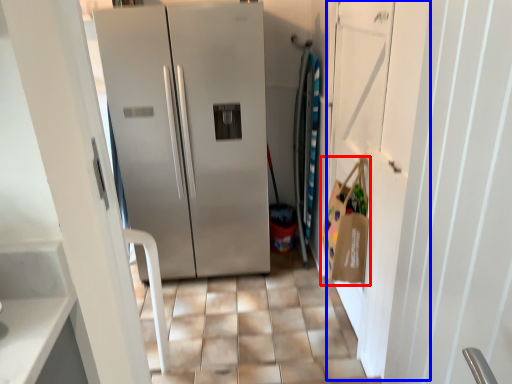
Question: Which of the following is the farthest to the observer, shopping bag (highlighted by a red box) or door (highlighted by a blue box)?

Choices:
 (A) shopping bag
 (B) door

Answer: (A)